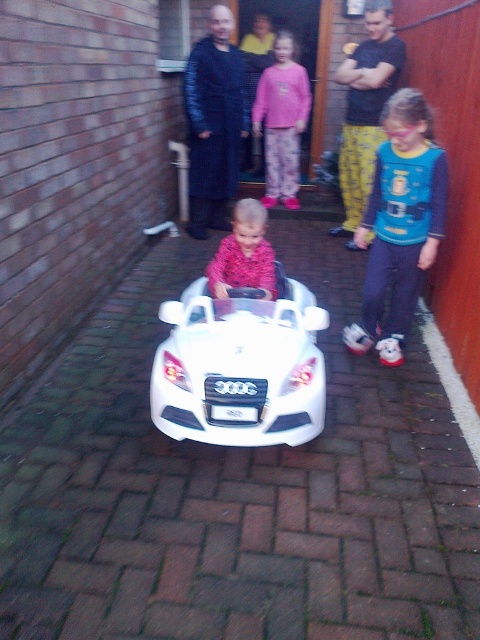
You are a photographer at the scene and want to position yourself to capture the blue fabric shirt at center in the frame. According to the coordinates provided, where should you aim your camera?

The blue fabric shirt at center is located at the 2D coordinates point (399, 225), so you should aim your camera at that specific coordinate to capture it in the frame.

You are a parent trying to decide whether to let your child play with the white plastic car at center and the blue fabric shirt at center. Based on the scene, which item is larger and safer for the child to handle?

The white plastic car at center is bigger than the blue fabric shirt at center, making it safer for the child to handle.